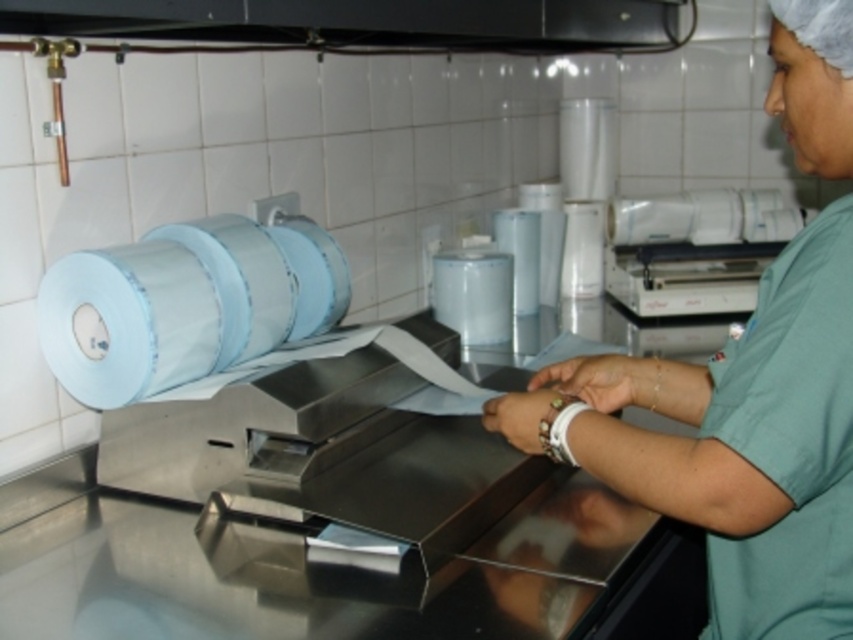
Can you confirm if green fabric at center is positioned to the left of blue glossy toilet paper at left?

No, green fabric at center is not to the left of blue glossy toilet paper at left.

Can you confirm if green fabric at center is positioned above blue glossy toilet paper at left?

Actually, green fabric at center is below blue glossy toilet paper at left.

From the picture: Who is more distant from viewer, (x=682, y=481) or (x=234, y=269)?

The point (x=234, y=269) is behind.

You are a GUI agent. You are given a task and a screenshot of the screen. Output one action in this format:
    pyautogui.click(x=<x>, y=<y>)
    Task: Click on the green fabric at center
    The image size is (853, 640).
    Given the screenshot: What is the action you would take?
    pos(735,442)

Is metallic stainless steel counter top at center smaller than green fabric at center?

No.

Consider the image. Does metallic stainless steel counter top at center appear over green fabric at center?

Actually, metallic stainless steel counter top at center is below green fabric at center.

Describe the element at coordinates (334, 570) in the screenshot. I see `metallic stainless steel counter top at center` at that location.

Find the location of a particular element. metallic stainless steel counter top at center is located at coordinates (334, 570).

Between metallic stainless steel counter top at center and white glossy toilet paper at upper right, which one appears on the right side from the viewer's perspective?

white glossy toilet paper at upper right

Can you confirm if metallic stainless steel counter top at center is thinner than white glossy toilet paper at upper right?

No.

I want to click on metallic stainless steel counter top at center, so click(334, 570).